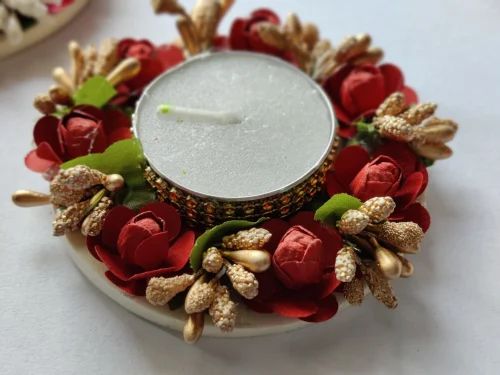
Where is `shadow of candle set`? shadow of candle set is located at coordinates (320, 346).